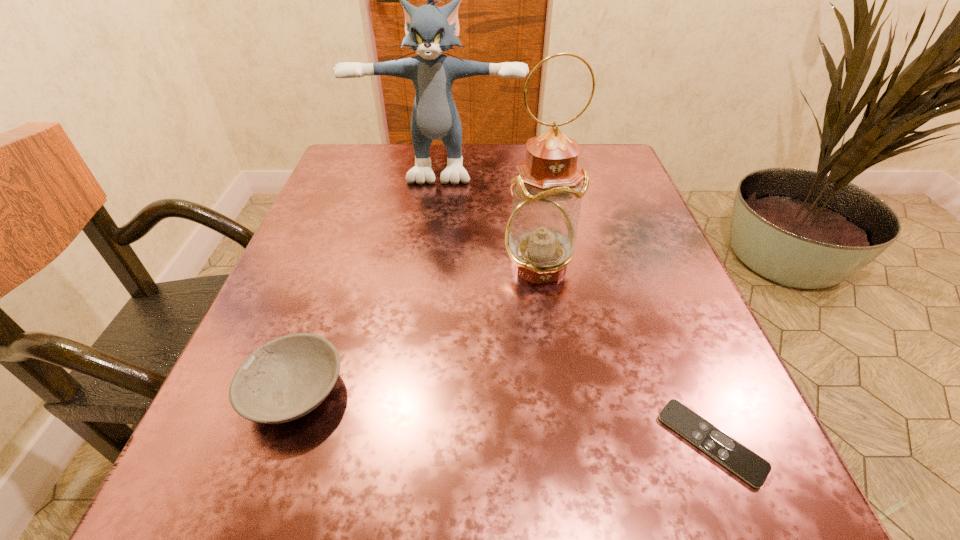
Locate an element on the screen. The height and width of the screenshot is (540, 960). object that is at the near edge is located at coordinates (753, 469).

The image size is (960, 540). What are the coordinates of `cat that is at the left edge` in the screenshot? It's located at (430, 30).

Identify the location of bowl at the left edge. (286, 378).

This screenshot has height=540, width=960. In order to click on object present at the right edge in this screenshot , I will do `click(753, 469)`.

Locate an element on the screen. This screenshot has height=540, width=960. object situated at the far left corner is located at coordinates (430, 30).

The height and width of the screenshot is (540, 960). Identify the location of object located at the near right corner. (753, 469).

In the image, there is a desktop. Identify the location of free space at the far edge. Image resolution: width=960 pixels, height=540 pixels. [475, 146].

Locate an element on the screen. This screenshot has width=960, height=540. vacant space at the near edge is located at coordinates (367, 502).

I want to click on vacant space at the left edge of the desktop, so click(324, 326).

Identify the location of vacant space at the right edge of the desktop. This screenshot has height=540, width=960. (642, 206).